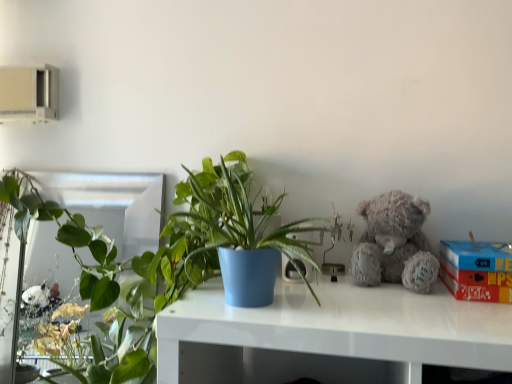
Question: Does green glossy plant at left, which is the first houseplant from back to front, contain matte blue pot at center, which is counted as the second houseplant, starting from the left?

Choices:
 (A) yes
 (B) no

Answer: (B)

Question: Is green glossy plant at left, which is counted as the second houseplant, starting from the front, smaller than matte blue pot at center, the 1th houseplant when ordered from right to left?

Choices:
 (A) yes
 (B) no

Answer: (B)

Question: Can you confirm if green glossy plant at left, which is counted as the second houseplant, starting from the front, is positioned to the right of matte blue pot at center, acting as the first houseplant starting from the front?

Choices:
 (A) yes
 (B) no

Answer: (B)

Question: Is the depth of green glossy plant at left, which is the first houseplant from back to front, less than that of matte blue pot at center, the 2th houseplant from the back?

Choices:
 (A) no
 (B) yes

Answer: (A)

Question: From the image's perspective, would you say green glossy plant at left, which is the first houseplant from back to front, is positioned over matte blue pot at center, acting as the first houseplant starting from the front?

Choices:
 (A) no
 (B) yes

Answer: (A)

Question: In terms of width, does matte blue pot at center, the 2th houseplant from the back, look wider or thinner when compared to fuzzy gray teddy bear at upper right?

Choices:
 (A) wide
 (B) thin

Answer: (A)

Question: Considering the positions of matte blue pot at center, the 2th houseplant from the back, and fuzzy gray teddy bear at upper right in the image, is matte blue pot at center, the 2th houseplant from the back, bigger or smaller than fuzzy gray teddy bear at upper right?

Choices:
 (A) small
 (B) big

Answer: (B)

Question: Considering their positions, is matte blue pot at center, acting as the first houseplant starting from the front, located in front of or behind fuzzy gray teddy bear at upper right?

Choices:
 (A) behind
 (B) front

Answer: (B)

Question: From a real-world perspective, is matte blue pot at center, the 1th houseplant when ordered from right to left, above or below fuzzy gray teddy bear at upper right?

Choices:
 (A) above
 (B) below

Answer: (A)

Question: From a real-world perspective, is red cardboard box at right physically located above or below fuzzy gray teddy bear at upper right?

Choices:
 (A) above
 (B) below

Answer: (B)

Question: Based on their sizes in the image, would you say red cardboard box at right is bigger or smaller than fuzzy gray teddy bear at upper right?

Choices:
 (A) big
 (B) small

Answer: (A)

Question: Is point pyautogui.click(x=493, y=279) closer or farther from the camera than point pyautogui.click(x=376, y=208)?

Choices:
 (A) farther
 (B) closer

Answer: (B)

Question: Is red cardboard box at right in front of or behind fuzzy gray teddy bear at upper right in the image?

Choices:
 (A) behind
 (B) front

Answer: (B)

Question: Relative to matte blue pot at center, acting as the first houseplant starting from the front, is green glossy plant at left, which is counted as the second houseplant, starting from the front, in front or behind?

Choices:
 (A) behind
 (B) front

Answer: (A)

Question: Would you say green glossy plant at left, the 2th houseplant from the right, is inside or outside matte blue pot at center, the 2th houseplant from the back?

Choices:
 (A) inside
 (B) outside

Answer: (B)